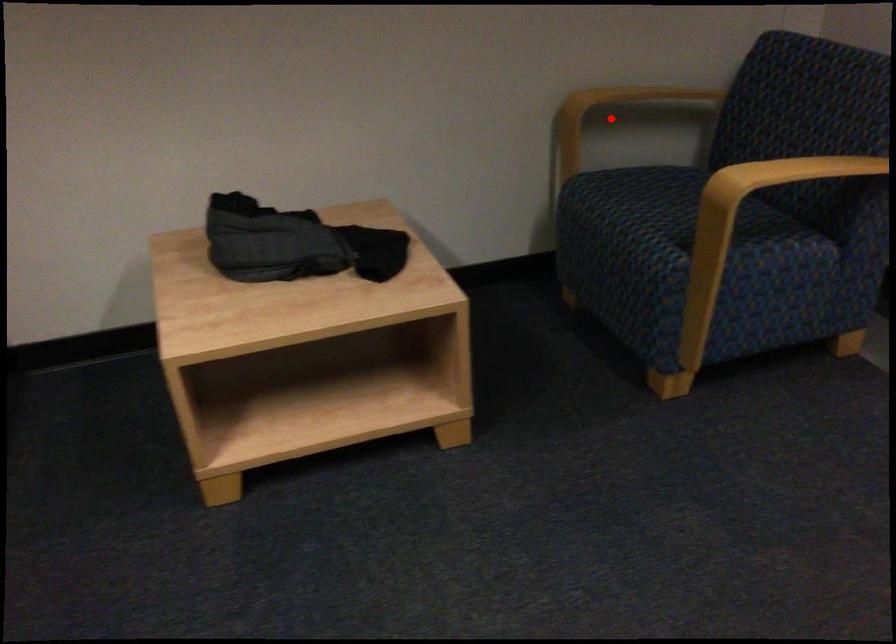
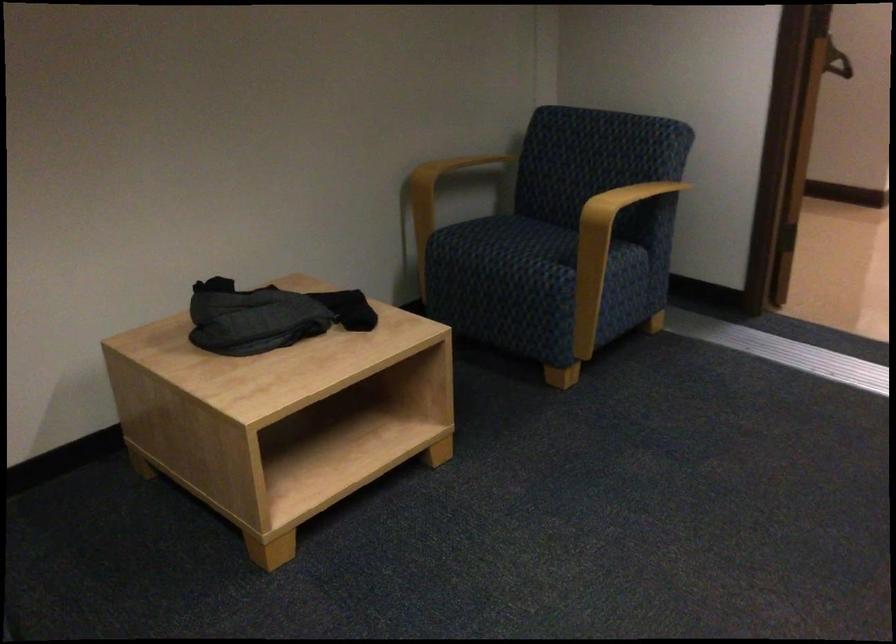
The point at the highlighted location is marked in the first image. Where is the corresponding point in the second image?

(437, 187)